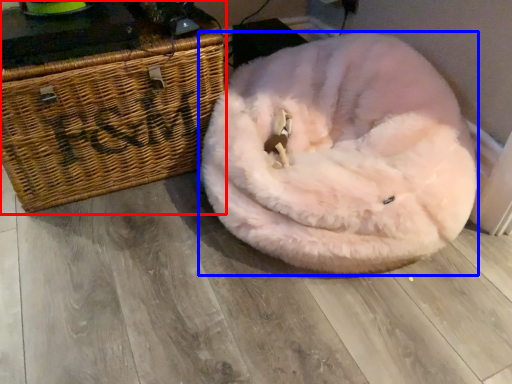
Question: Among these objects, which one is nearest to the camera, furniture (highlighted by a red box) or dog bed (highlighted by a blue box)?

Choices:
 (A) furniture
 (B) dog bed

Answer: (B)